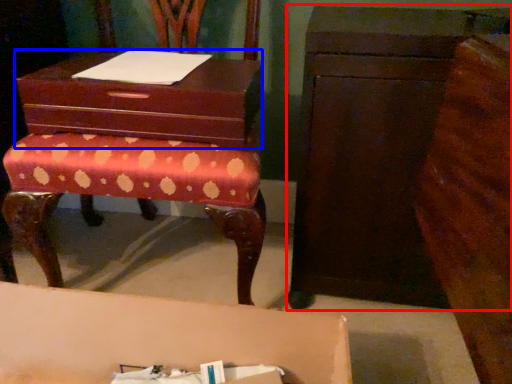
Question: Which of the following is the closest to the observer, chest of drawers (highlighted by a red box) or storage box (highlighted by a blue box)?

Choices:
 (A) chest of drawers
 (B) storage box

Answer: (A)